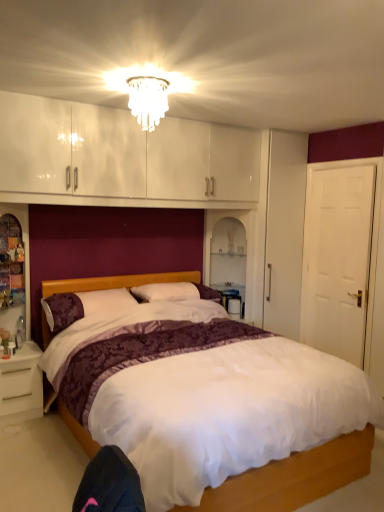
Question: From the image's perspective, is white glossy table at right above translucent glass chandelier at upper center?

Choices:
 (A) no
 (B) yes

Answer: (A)

Question: Can we say white glossy table at right lies outside translucent glass chandelier at upper center?

Choices:
 (A) no
 (B) yes

Answer: (B)

Question: Does white glossy table at right appear on the right side of translucent glass chandelier at upper center?

Choices:
 (A) yes
 (B) no

Answer: (A)

Question: Is white glossy table at right positioned behind translucent glass chandelier at upper center?

Choices:
 (A) yes
 (B) no

Answer: (A)

Question: Is the position of white glossy table at right less distant than that of translucent glass chandelier at upper center?

Choices:
 (A) yes
 (B) no

Answer: (B)

Question: In terms of size, does translucent glass chandelier at upper center appear bigger or smaller than white glossy table at right?

Choices:
 (A) big
 (B) small

Answer: (B)

Question: From a real-world perspective, is translucent glass chandelier at upper center physically located above or below white glossy table at right?

Choices:
 (A) above
 (B) below

Answer: (A)

Question: Considering the relative positions of translucent glass chandelier at upper center and white glossy table at right in the image provided, is translucent glass chandelier at upper center to the left or to the right of white glossy table at right?

Choices:
 (A) left
 (B) right

Answer: (A)

Question: Is point (152, 117) positioned closer to the camera than point (243, 310)?

Choices:
 (A) farther
 (B) closer

Answer: (B)

Question: From a real-world perspective, is white matte door at right positioned above or below white satin bed at center?

Choices:
 (A) below
 (B) above

Answer: (B)

Question: In terms of height, does white matte door at right look taller or shorter compared to white satin bed at center?

Choices:
 (A) short
 (B) tall

Answer: (B)

Question: In the image, is white matte door at right positioned in front of or behind white satin bed at center?

Choices:
 (A) front
 (B) behind

Answer: (B)

Question: Considering the positions of point (367, 244) and point (296, 500), is point (367, 244) closer or farther from the camera than point (296, 500)?

Choices:
 (A) closer
 (B) farther

Answer: (B)

Question: From the image's perspective, is white glossy table at right located above or below translucent glass chandelier at upper center?

Choices:
 (A) above
 (B) below

Answer: (B)

Question: Is white glossy table at right wider or thinner than translucent glass chandelier at upper center?

Choices:
 (A) thin
 (B) wide

Answer: (A)